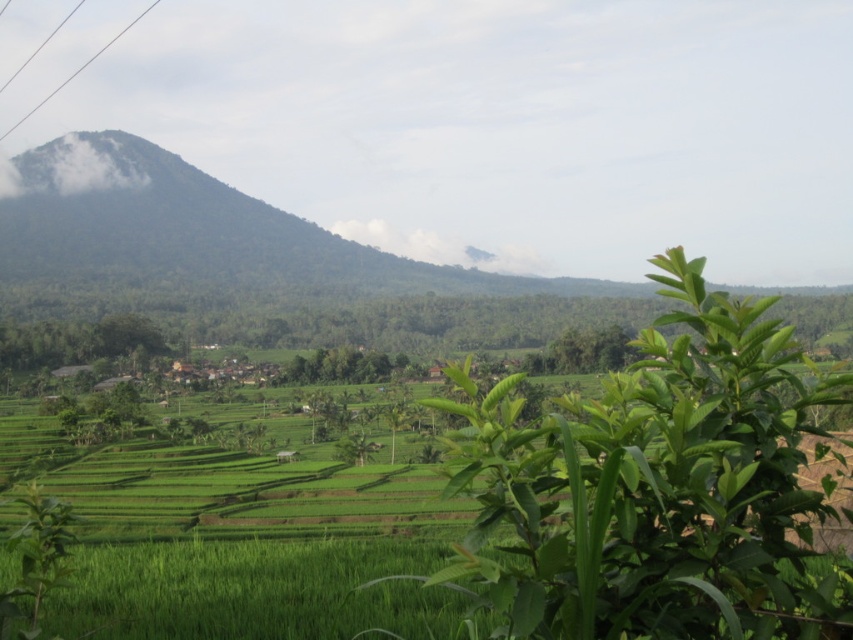
Question: Can you confirm if green leafy plant at center is smaller than metallic wire at upper left?

Choices:
 (A) yes
 (B) no

Answer: (A)

Question: Does green leafy plant at center have a greater width compared to metallic wire at upper left?

Choices:
 (A) yes
 (B) no

Answer: (B)

Question: Does green leafy plant at center appear under metallic wire at upper left?

Choices:
 (A) no
 (B) yes

Answer: (B)

Question: Which object appears closest to the camera in this image?

Choices:
 (A) green leafy plant at center
 (B) metallic wire at upper left

Answer: (A)